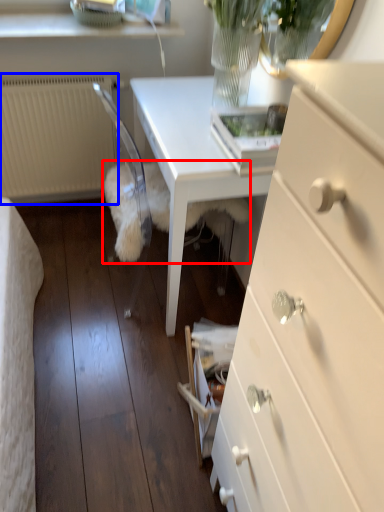
Question: Which object appears farthest to the camera in this image, animal (highlighted by a red box) or radiator (highlighted by a blue box)?

Choices:
 (A) animal
 (B) radiator

Answer: (B)